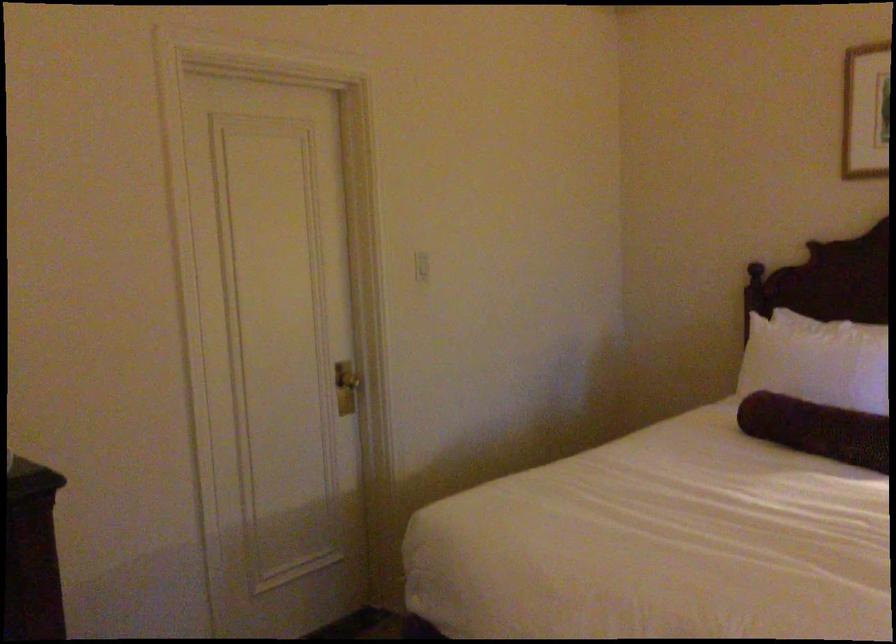
What do you see at coordinates (345, 377) in the screenshot? The image size is (896, 644). I see `the gold door handle` at bounding box center [345, 377].